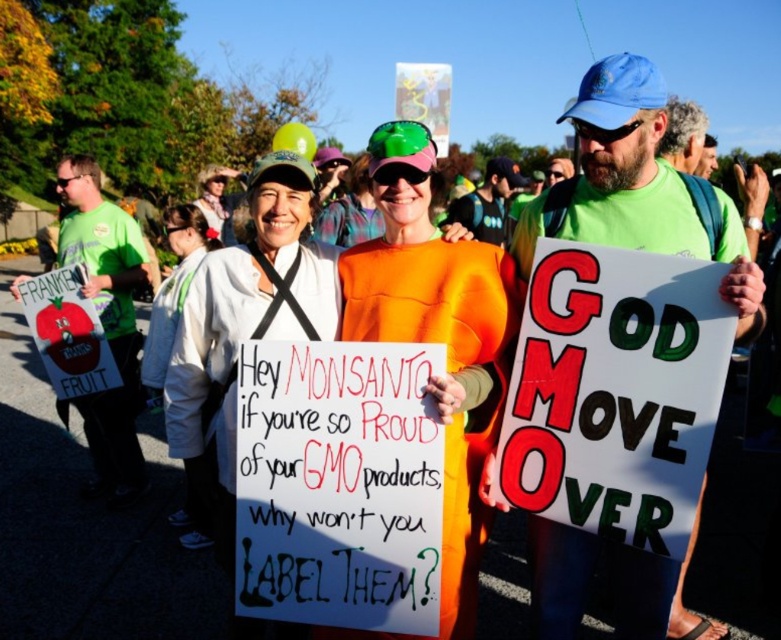
Which is below, white cardboard sign at center or white fleece jacket at center?

white cardboard sign at center is lower down.

Who is more distant from viewer, [540,436] or [188,504]?

The point [188,504] is behind.

The image size is (781, 640). In order to click on white cardboard sign at center in this screenshot , I will do `click(615, 392)`.

Is point (551, 420) positioned after point (469, 353)?

No, it is in front of (469, 353).

Is point (607, 300) positioned before point (377, 314)?

Yes, it is in front of point (377, 314).

Identify the location of white cardboard sign at center. This screenshot has height=640, width=781. (615, 392).

Is orange fabric sign at center taller than orange fabric dress at center?

No.

Can you confirm if orange fabric sign at center is bigger than orange fabric dress at center?

No.

This screenshot has height=640, width=781. I want to click on orange fabric sign at center, so click(x=337, y=484).

Where is `orange fabric sign at center`? orange fabric sign at center is located at coordinates (337, 484).